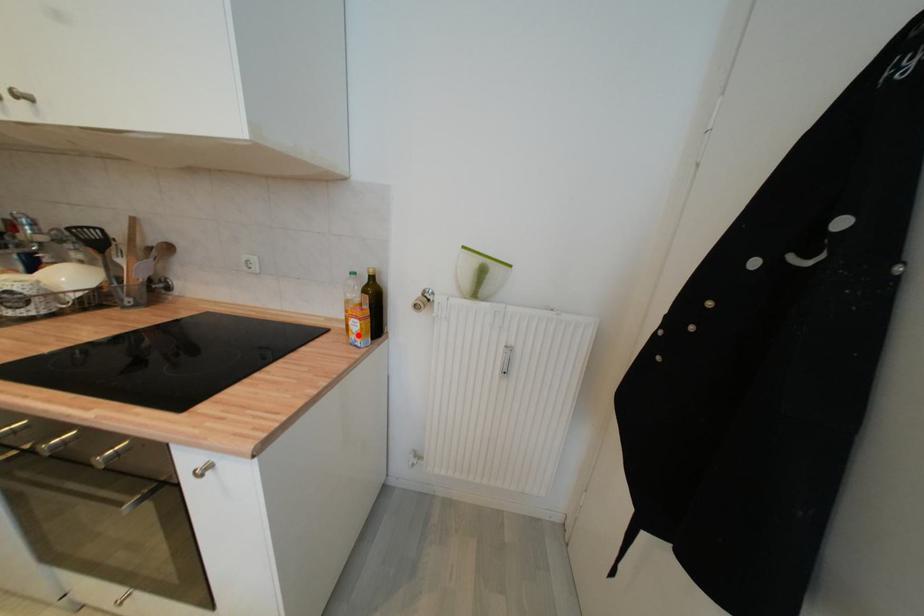
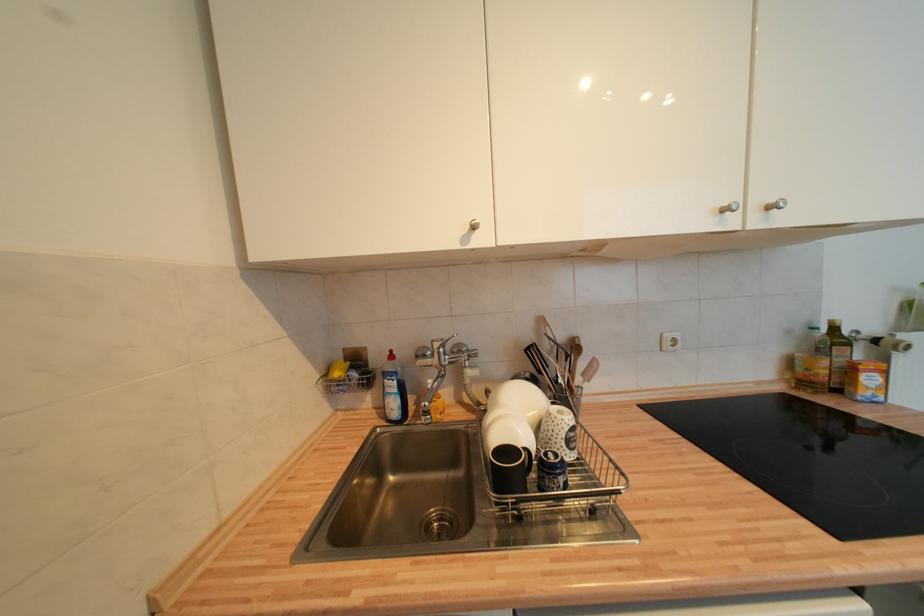
The point at the highlighted location is marked in the first image. Where is the corresponding point in the second image?

(873, 391)